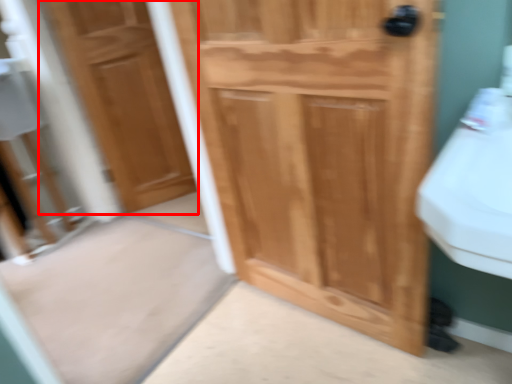
Question: Observing the image, what is the correct spatial positioning of door (annotated by the red box) in reference to door?

Choices:
 (A) right
 (B) left

Answer: (B)